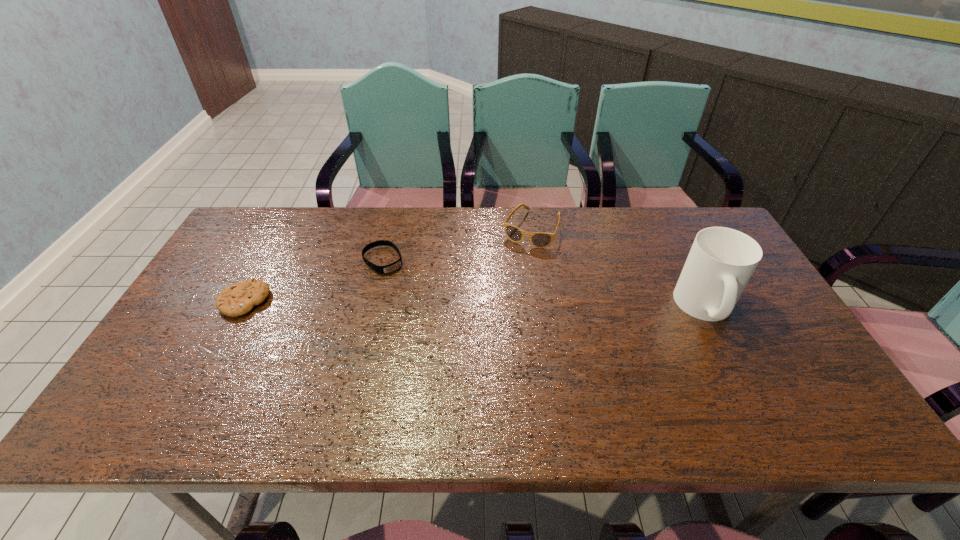
This screenshot has width=960, height=540. In order to click on vacant space on the desktop that is between the cookie and the mug and is positioned on the display of the wristband in this screenshot , I will do `click(422, 303)`.

Where is `free space on the desktop that is between the cookie and the mug and is positioned on the front-facing side of the third shortest object`? This screenshot has height=540, width=960. free space on the desktop that is between the cookie and the mug and is positioned on the front-facing side of the third shortest object is located at coordinates (492, 305).